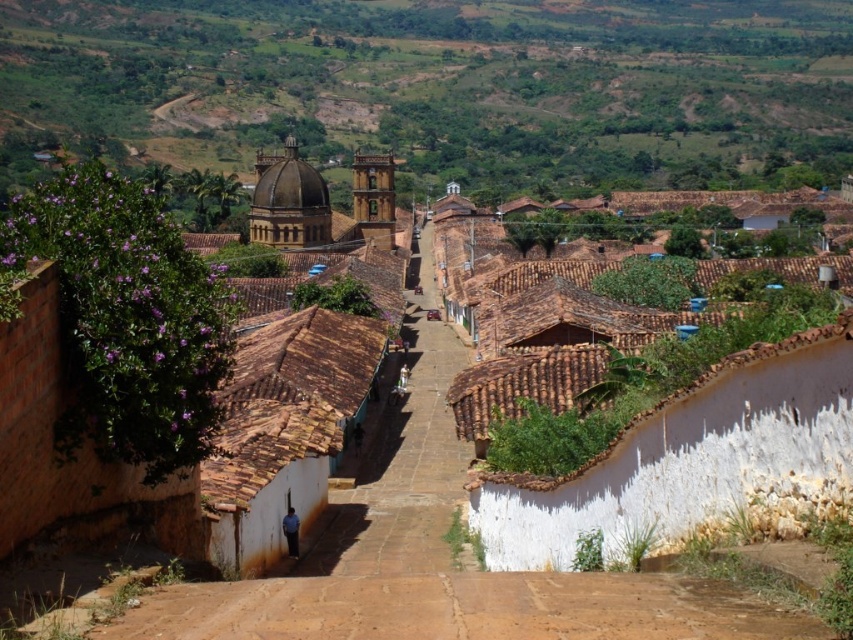
Who is positioned more to the right, brown earthy dirt track at center or brown tiled path at center?

brown earthy dirt track at center is more to the right.

Between brown earthy dirt track at center and brown tiled path at center, which one appears on the left side from the viewer's perspective?

From the viewer's perspective, brown tiled path at center appears more on the left side.

Who is more distant from viewer, (x=796, y=618) or (x=405, y=410)?

Positioned behind is point (x=405, y=410).

The width and height of the screenshot is (853, 640). Find the location of `brown earthy dirt track at center`. brown earthy dirt track at center is located at coordinates (460, 609).

Who is shorter, green grassy hillside at upper center or brown earthy dirt track at center?

brown earthy dirt track at center is shorter.

Which is in front, point (593, 84) or point (234, 625)?

Point (234, 625) is more forward.

This screenshot has height=640, width=853. I want to click on green grassy hillside at upper center, so click(x=444, y=88).

Find the location of a particular element. green grassy hillside at upper center is located at coordinates (444, 88).

Can you confirm if green grassy hillside at upper center is wider than brown tiled path at center?

Yes, green grassy hillside at upper center is wider than brown tiled path at center.

Locate an element on the screen. green grassy hillside at upper center is located at coordinates (444, 88).